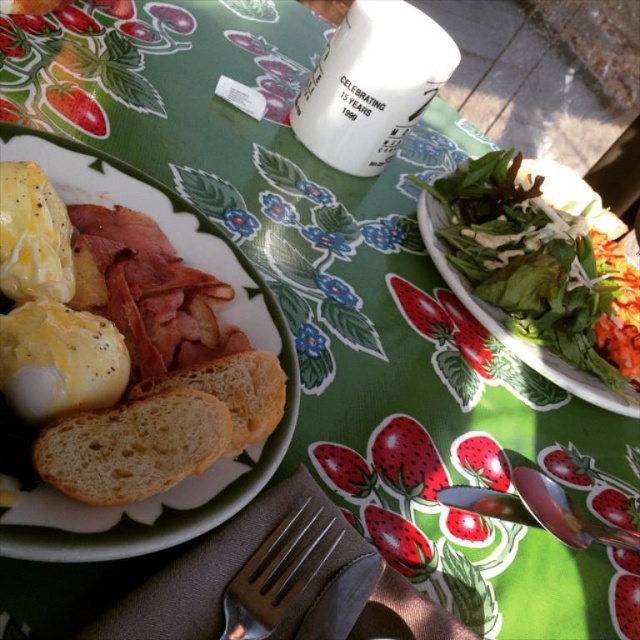
You are a chef arranging a buffet table and need to place a new dish between the green leafy salad at upper right and the golden brown crusty bread at center. The dish is 15 inches wide. Will there be enough space between them to fit the dish?

The distance between the green leafy salad at upper right and the golden brown crusty bread at center is 16.45 inches. Since the dish is 15 inches wide, there is enough space to fit it between them.

You are a diner sitting at the table and want to pick up the satin silver fork at lower center. Which direction should you move your hand from the golden brown crusty bread at center?

The golden brown crusty bread at center is to the left of the satin silver fork at lower center, so you should move your hand to the right to reach the satin silver fork at lower center.